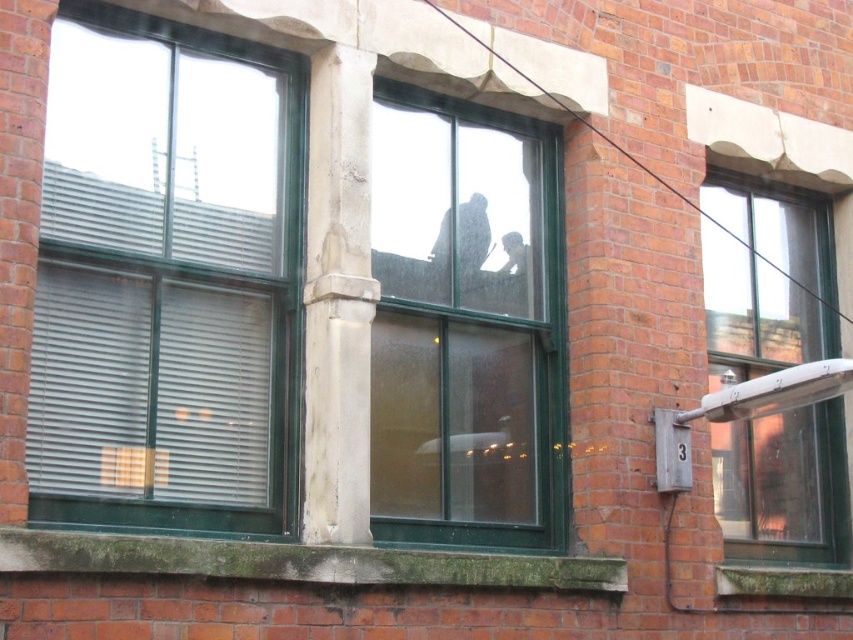
Question: Does green glass window at center come in front of clear glass window at right?

Choices:
 (A) no
 (B) yes

Answer: (B)

Question: Estimate the real-world distances between objects in this image. Which object is closer to the green glass window at left?

Choices:
 (A) clear glass window at right
 (B) green glass window at center

Answer: (B)

Question: Based on their relative distances, which object is nearer to the green glass window at left?

Choices:
 (A) clear glass window at right
 (B) green glass window at center

Answer: (B)

Question: Which object appears farthest from the camera in this image?

Choices:
 (A) clear glass window at right
 (B) green glass window at center
 (C) green glass window at left

Answer: (A)

Question: Can you confirm if green glass window at center is wider than clear glass window at right?

Choices:
 (A) yes
 (B) no

Answer: (A)

Question: Is green glass window at left wider than clear glass window at right?

Choices:
 (A) no
 (B) yes

Answer: (B)